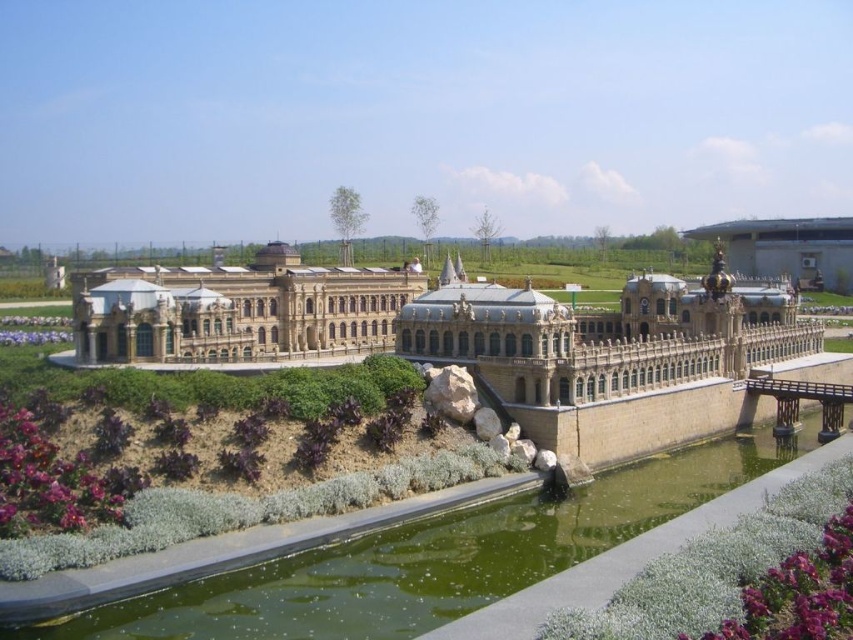
You are standing in the garden of the miniature model and want to place a small statue between the greenish water at lower center and the golden stone palace at center. Based on their positions, where should the statue be placed?

The greenish water at lower center is below the golden stone palace at center, so the statue should be placed between them in the lower area near the water.

You are a visitor standing in the garden, looking at the greenish water at lower center and the golden stone palace at center. Which object is closer to you?

The greenish water at lower center is closer to you because it is positioned in front of the golden stone palace at center.

You are a landscape architect designing a walking path between the greenish water at lower center and the golden stone palace at center. What is the minimum distance the path must cover to connect them?

The minimum distance between the greenish water at lower center and the golden stone palace at center is 56.30 meters, so the path must be at least 56.30 meters long.